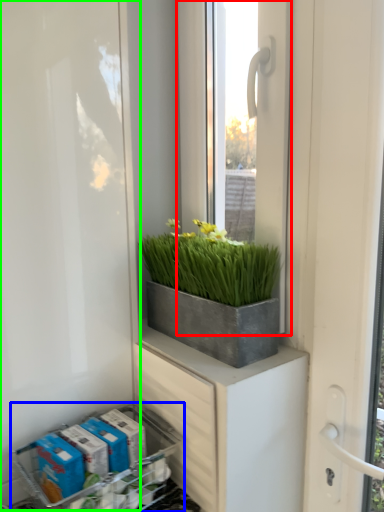
Question: Which is nearer to the window (highlighted by a red box)? flower box (highlighted by a blue box) or screen door (highlighted by a green box).

Choices:
 (A) flower box
 (B) screen door

Answer: (B)